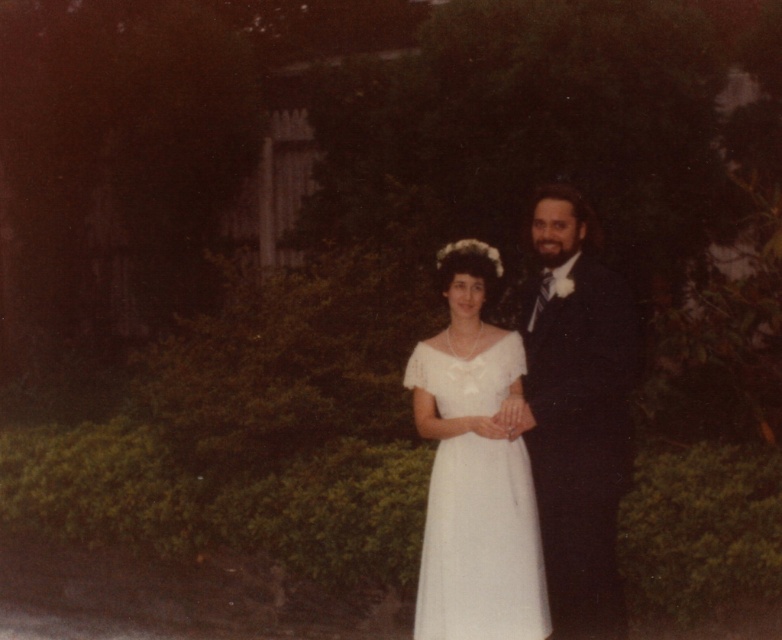
You are a photographer setting up for a formal event. You need to position the shiny black suit at right and the white satin dress at center so that they are both visible in the frame. Considering their sizes, which object might require more space to the side to ensure it doesn not get cut off?

The white satin dress at center requires more space to the side because it has a greater width than the shiny black suit at right.

Based on the photo, you are a photographer setting up for a formal event. You need to position a spotlight so that it illuminates both the shiny black suit at right and the white satin dress at center without casting shadows. Considering their heights, which object should be placed closer to the spotlight to ensure even lighting?

The shiny black suit at right is taller than the white satin dress at center, so placing the shiny black suit at right closer to the spotlight would help ensure even lighting between both subjects.